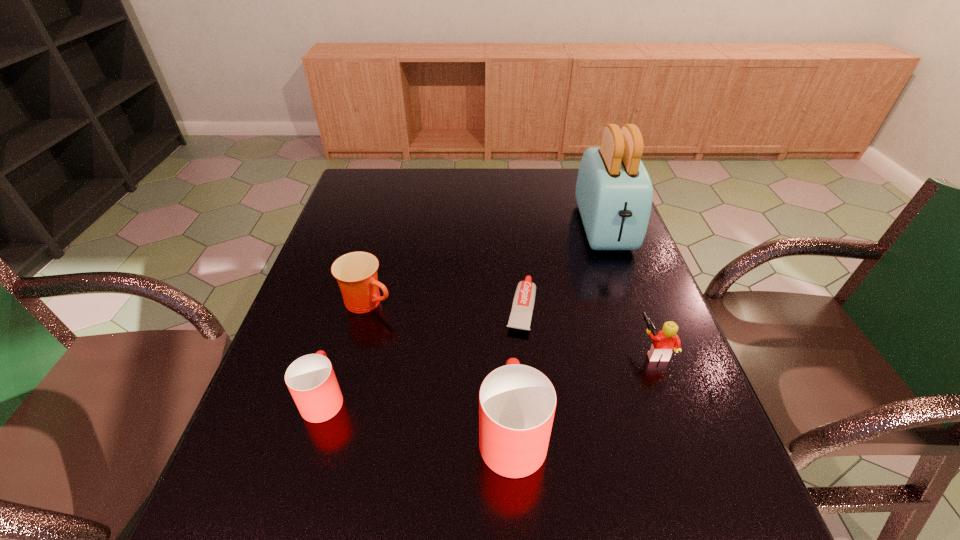
Where is `object at the far right corner`? Image resolution: width=960 pixels, height=540 pixels. object at the far right corner is located at coordinates (614, 193).

Find the location of a particular element. vacant space at the far edge of the desktop is located at coordinates tap(467, 178).

Where is `vacant space at the near edge of the desktop`? vacant space at the near edge of the desktop is located at coordinates (343, 439).

In the image, there is a desktop. Where is `vacant space at the left edge`? vacant space at the left edge is located at coordinates (375, 206).

Image resolution: width=960 pixels, height=540 pixels. I want to click on vacant region at the right edge of the desktop, so click(636, 326).

You are a GUI agent. You are given a task and a screenshot of the screen. Output one action in this format:
    pyautogui.click(x=<x>, y=<y>)
    Task: Click on the free space at the near left corner
    The height and width of the screenshot is (540, 960).
    Given the screenshot: What is the action you would take?
    pyautogui.click(x=267, y=456)

This screenshot has width=960, height=540. I want to click on vacant point located between the fourth farthest object and the tallest cup, so click(584, 391).

Identify the location of vacant space in between the farthest cup and the toothpaste. This screenshot has width=960, height=540. (444, 305).

This screenshot has height=540, width=960. Find the location of `unoccupied position between the farthest cup and the shortest object`. unoccupied position between the farthest cup and the shortest object is located at coordinates (444, 305).

At what (x,y) coordinates should I click in order to perform the action: click on unoccupied area between the shortest object and the farthest cup. Please return your answer as a coordinate pair (x, y). Image resolution: width=960 pixels, height=540 pixels. Looking at the image, I should click on (444, 305).